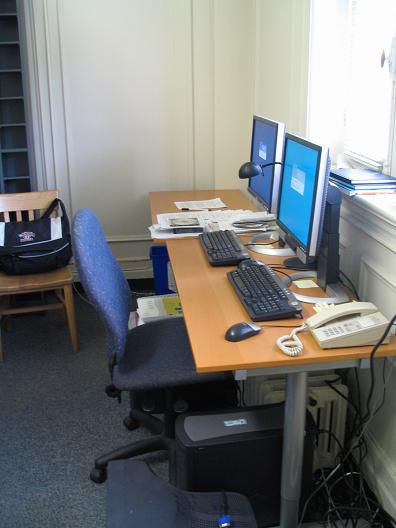
You are a GUI agent. You are given a task and a screenshot of the screen. Output one action in this format:
    pyautogui.click(x=<x>, y=<y>)
    Task: Click on the computer
    
    Given the screenshot: What is the action you would take?
    pyautogui.click(x=230, y=458)